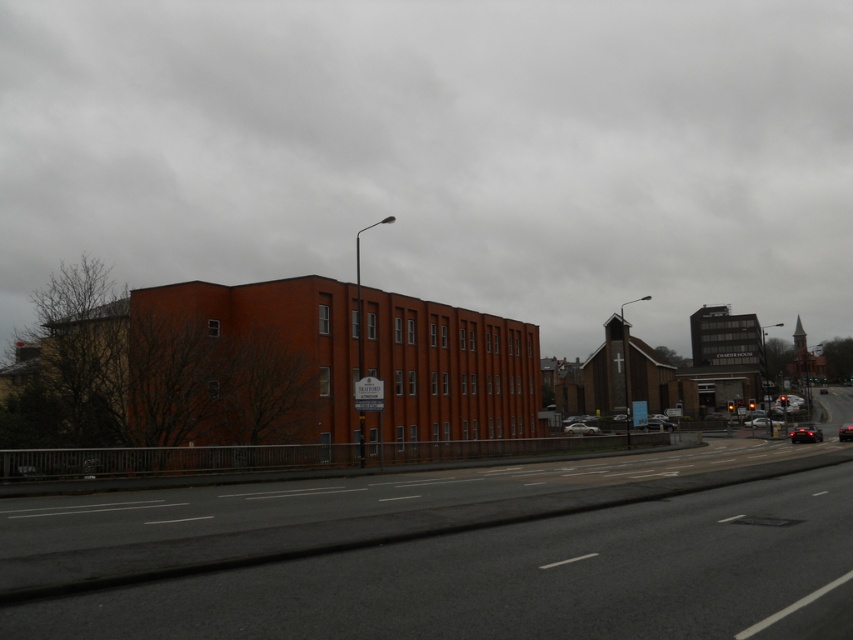
Does metallic silver car at center have a smaller size compared to black glossy car at center?

Yes.

Does metallic silver car at center have a greater width compared to black glossy car at center?

No, metallic silver car at center is not wider than black glossy car at center.

Where is `metallic silver car at center`? The width and height of the screenshot is (853, 640). metallic silver car at center is located at coordinates (659, 422).

You are a GUI agent. You are given a task and a screenshot of the screen. Output one action in this format:
    pyautogui.click(x=<x>, y=<y>)
    Task: Click on the metallic silver car at center
    This screenshot has height=640, width=853.
    Given the screenshot: What is the action you would take?
    pyautogui.click(x=659, y=422)

Is point (651, 426) farther from viewer compared to point (756, 420)?

No, (651, 426) is closer to viewer.

Find the location of a particular element. This screenshot has width=853, height=640. metallic silver car at center is located at coordinates (659, 422).

Based on the photo, can you confirm if shiny black car at right is wider than black glossy car at center?

In fact, shiny black car at right might be narrower than black glossy car at center.

Is point (799, 428) in front of point (840, 429)?

No.

Image resolution: width=853 pixels, height=640 pixels. Find the location of `shiny black car at right`. shiny black car at right is located at coordinates click(805, 433).